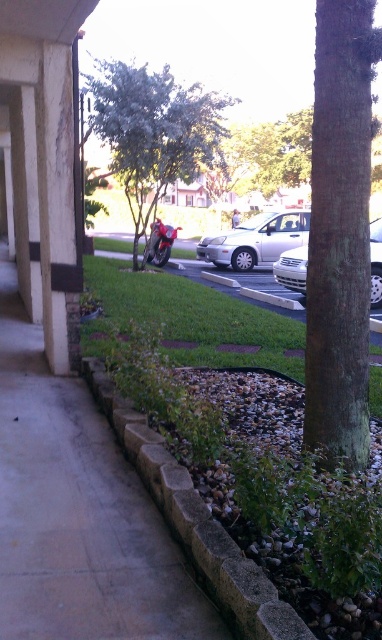
You are a photographer planning to take a picture of the shiny red motorcycle at center. However, you notice that the green leafy tree at center might block your view. Can you confirm if the tree is blocking the motorcycle?

The green leafy tree at center is positioned over shiny red motorcycle at center, so the tree is blocking the motorcycle.

You are standing on the paved walkway and want to walk towards the shiny red motorcycle at center. Which direction should you go to get closer to it without crossing the green grass at center?

Since the green grass at center is closer to the viewer than the shiny red motorcycle at center, you should move forward away from the green grass at center to reach the shiny red motorcycle at center without crossing it.